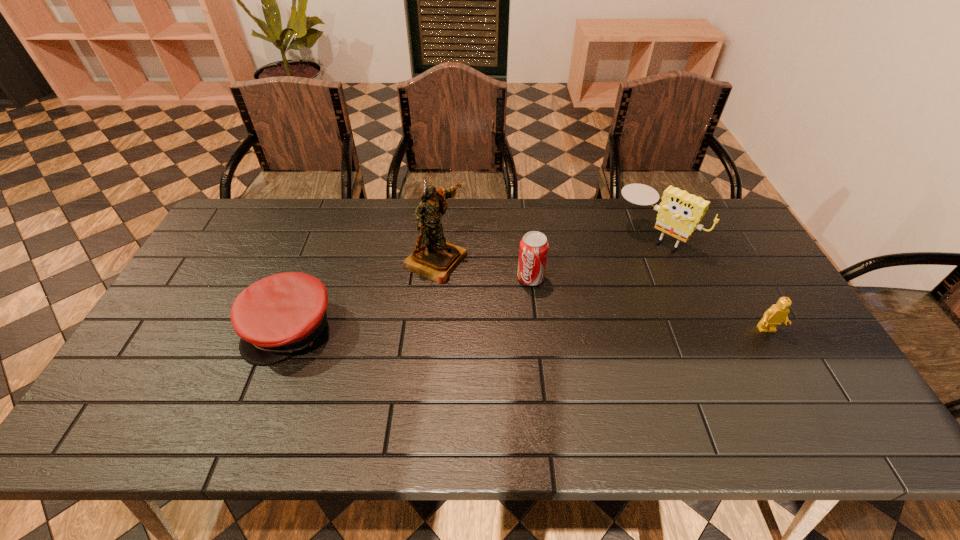
Find the location of a particular element. free spot on the desktop that is between the leftmost object and the Lego and is positioned on the logo side of the third object from left to right is located at coordinates (496, 329).

At what (x,y) coordinates should I click in order to perform the action: click on vacant spot on the desktop that is between the leftmost object and the rightmost object and is positioned on the front-facing side of the tallest object. Please return your answer as a coordinate pair (x, y). Looking at the image, I should click on (596, 329).

I want to click on free space on the desktop that is between the leftmost object and the rightmost object and is positioned on the front-facing side of the sponge, so click(x=561, y=329).